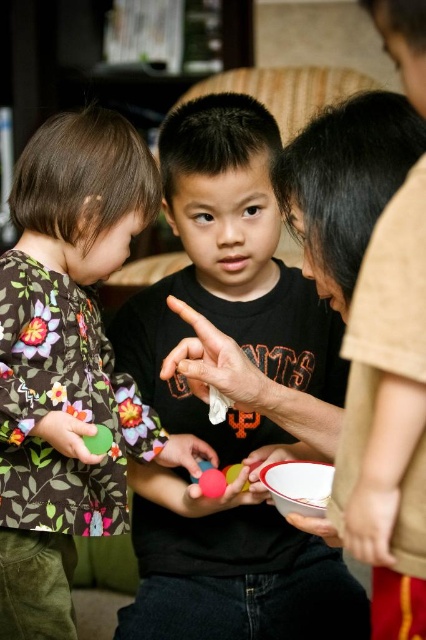
Does floral fabric shirt at left appear over rubber matte ball at center?

Indeed, floral fabric shirt at left is positioned over rubber matte ball at center.

Where is `floral fabric shirt at left`? The image size is (426, 640). floral fabric shirt at left is located at coordinates (66, 358).

Is white matte hand at center shorter than white glossy bowl at center?

In fact, white matte hand at center may be taller than white glossy bowl at center.

Which is above, white matte hand at center or white glossy bowl at center?

white matte hand at center is higher up.

Is point (173, 372) closer to camera compared to point (258, 470)?

No.

Find the location of a particular element. This screenshot has height=640, width=426. white matte hand at center is located at coordinates (215, 364).

Is green matte ball at lower left positioned behind smooth rubber ball at center?

That is False.

Based on the photo, measure the distance between green matte ball at lower left and smooth rubber ball at center.

A distance of 10.14 inches exists between green matte ball at lower left and smooth rubber ball at center.

Measure the distance between point (77, 440) and camera.

Point (77, 440) and camera are 71.10 centimeters apart.

The image size is (426, 640). I want to click on green matte ball at lower left, so coord(66,435).